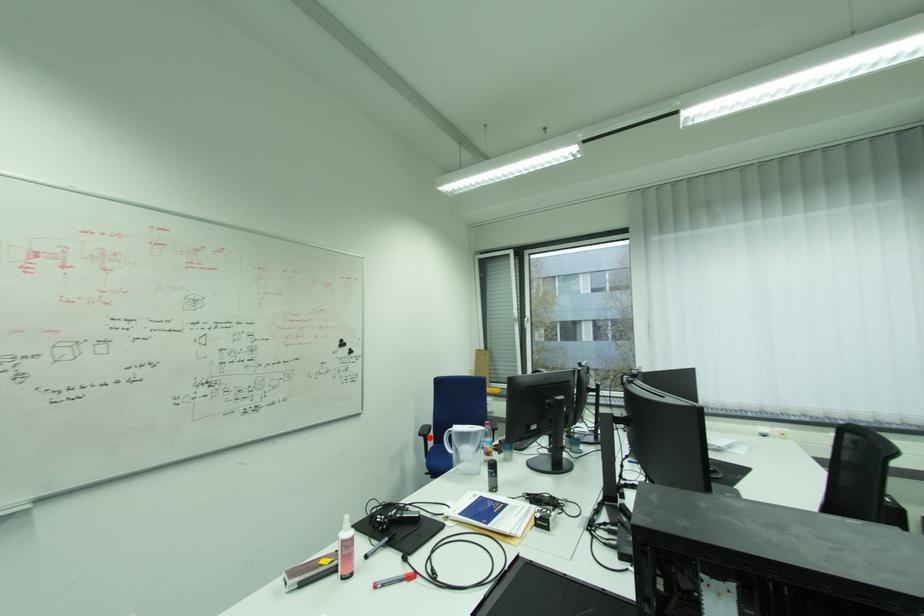
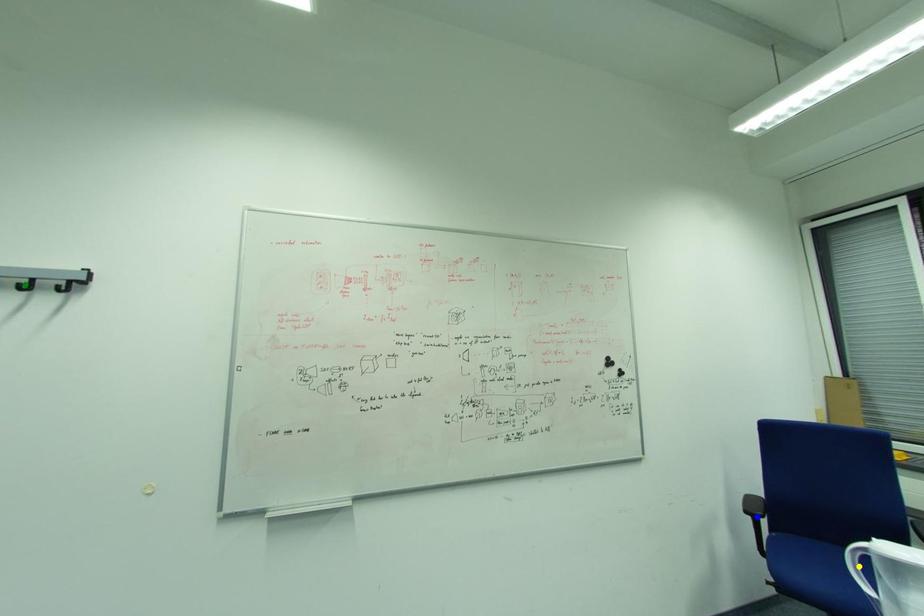
Question: I am providing you with two images of the same scene from different viewpoints. A red point is marked on the first image. You are given multiple points on the second image. Which spot in image 2 lines up with the point in image 1?

Choices:
 (A) yellow point
 (B) blue point
 (C) green point

Answer: (B)